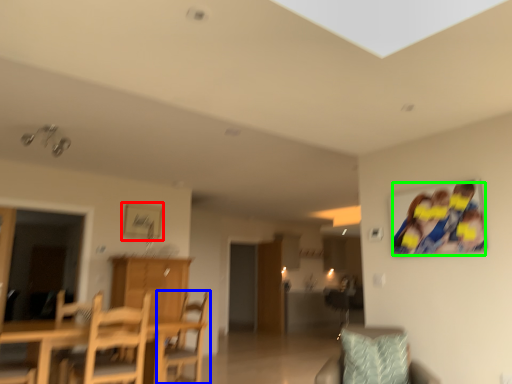
Question: Which is farther away from picture frame (highlighted by a red box)? chair (highlighted by a blue box) or couple (highlighted by a green box)?

Choices:
 (A) chair
 (B) couple

Answer: (B)